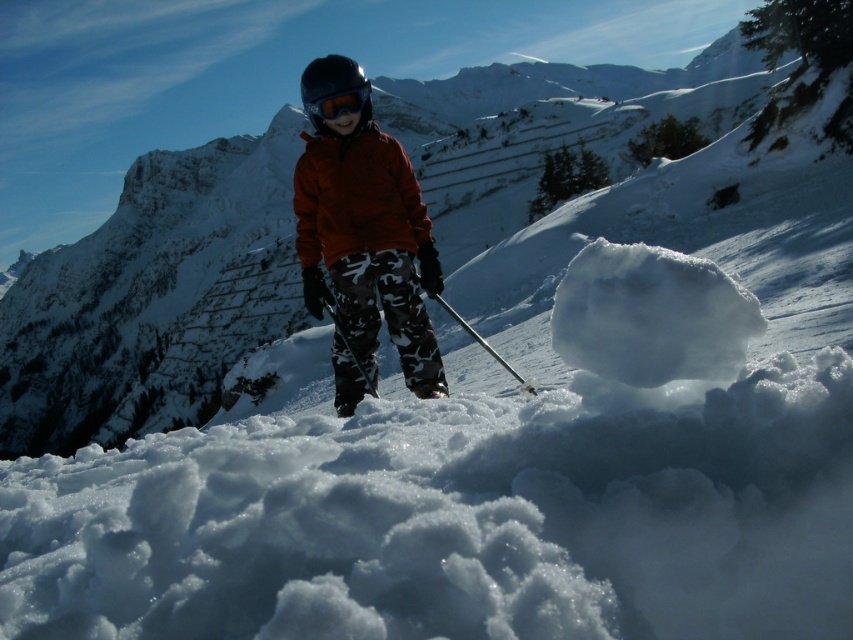
You are a drone operator trying to locate the skier in the image. The skier is wearing a matte red jacket at center. The coordinates given are point (355,196). Based on the scene description, can you confirm if this point is where the skier is located?

Yes, the point (355,196) indicates the location of the matte red jacket at center, which is where the skier is positioned in the image.

You are a photographer trying to capture the skier in the scene. You notice the matte red jacket at center and the matte black goggles at center. Which object should you focus on first if you want to ensure both are in sharp focus?

You should focus on the matte red jacket at center first since it is closer to the viewer than the matte black goggles at center. By focusing on the closer object, the goggles will likely be within the depth of field, ensuring both are in focus.

Consider the image. You are a photographer trying to capture the skier in the scene. You want to ensure both the orange softshell jacket at center and the matte black goggles at center are clearly visible in your shot. Given their positions, which object might require more careful framing to avoid being obscured?

The orange softshell jacket at center might be wider than the matte black goggles at center, so the goggles might need more careful framing to ensure they are not obscured by the jacket.